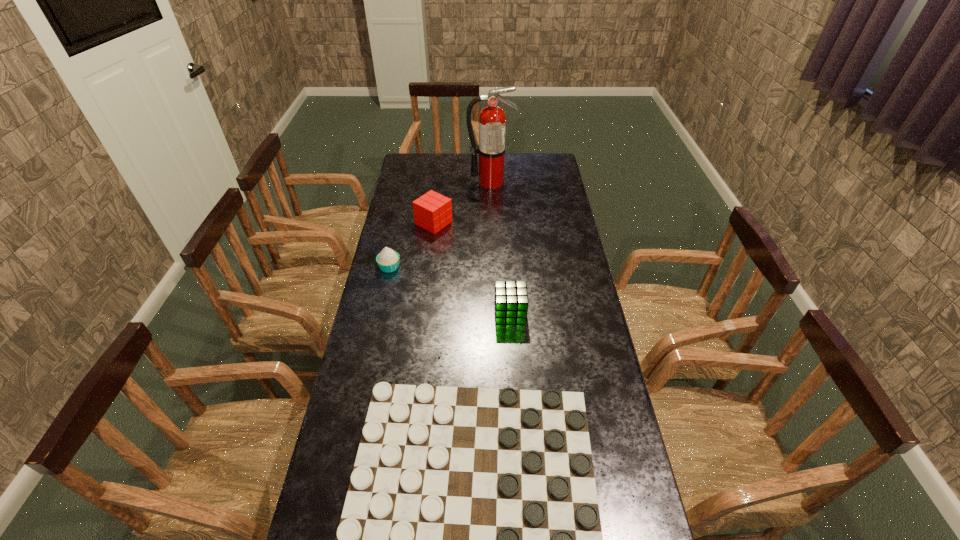
Locate an element on the screen. The image size is (960, 540). blank region between the left cube and the nearer cube is located at coordinates (472, 268).

The width and height of the screenshot is (960, 540). Identify the location of free point between the fourth nearest object and the cupcake. (412, 245).

You are a GUI agent. You are given a task and a screenshot of the screen. Output one action in this format:
    pyautogui.click(x=<x>, y=<y>)
    Task: Click on the vacant space in between the left cube and the nearer cube
    Image resolution: width=960 pixels, height=540 pixels.
    Given the screenshot: What is the action you would take?
    pyautogui.click(x=472, y=268)

Where is `the second closest object to the fire extinguisher`? This screenshot has width=960, height=540. the second closest object to the fire extinguisher is located at coordinates (388, 260).

Point out which object is positioned as the fourth nearest to the third nearest object. Please provide its 2D coordinates. Your answer should be formatted as a tuple, i.e. [(x, y)], where the tuple contains the x and y coordinates of a point satisfying the conditions above.

[(492, 120)]

I want to click on free space that satisfies the following two spatial constraints: 1. on the front side of the farther cube; 2. on the left side of the nearer cube, so click(422, 313).